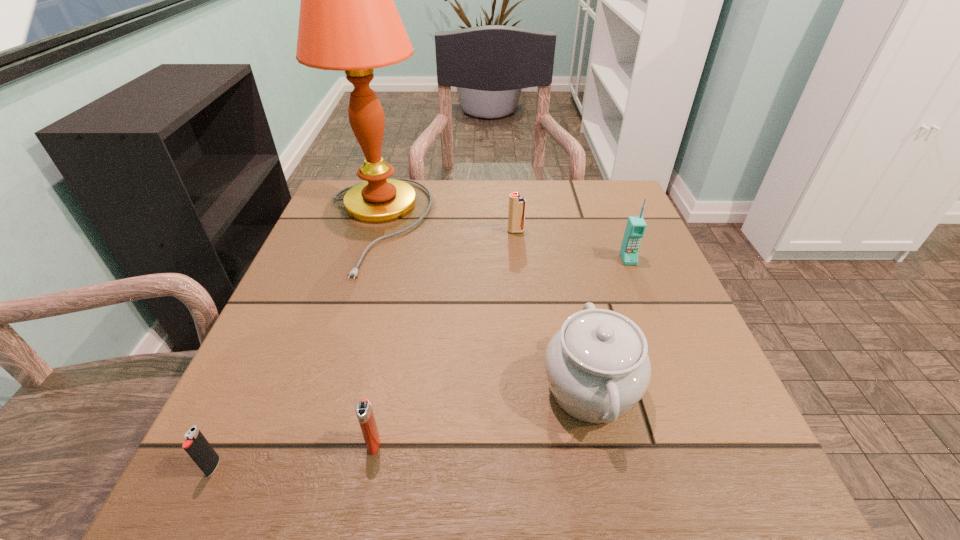
Where is `object located in the far left corner section of the desktop`? Image resolution: width=960 pixels, height=540 pixels. object located in the far left corner section of the desktop is located at coordinates (348, 21).

Identify the location of object at the near left corner. The width and height of the screenshot is (960, 540). (196, 445).

Locate an element on the screen. object that is at the near right corner is located at coordinates (597, 366).

Where is `free space at the far edge of the desktop`? This screenshot has width=960, height=540. free space at the far edge of the desktop is located at coordinates click(522, 192).

Where is `vacant space at the near edge of the desktop`? The height and width of the screenshot is (540, 960). vacant space at the near edge of the desktop is located at coordinates (401, 466).

This screenshot has height=540, width=960. I want to click on free space at the left edge, so click(234, 408).

Identify the location of vacant area at the right edge. (580, 238).

What are the coordinates of `vacant space in between the rightmost object and the shortest object` in the screenshot? It's located at (420, 363).

Find the location of a particular element. The height and width of the screenshot is (540, 960). free area in between the nearest object and the lamp is located at coordinates (295, 346).

At what (x,y) coordinates should I click in order to perform the action: click on free space that is in between the rightmost object and the shortest object. Please return your answer as a coordinate pair (x, y). Looking at the image, I should click on (420, 363).